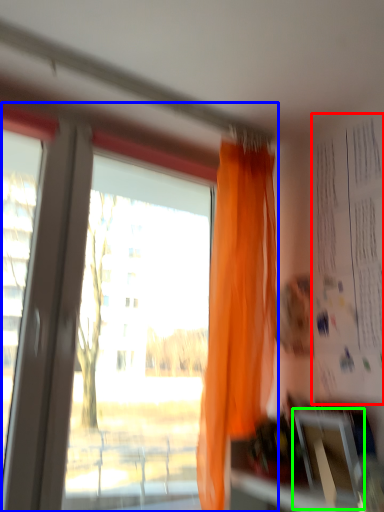
Question: Based on their relative distances, which object is farther from bulletin board (highlighted by a red box)? Choose from window (highlighted by a blue box) and window screen (highlighted by a green box).

Choices:
 (A) window
 (B) window screen

Answer: (A)